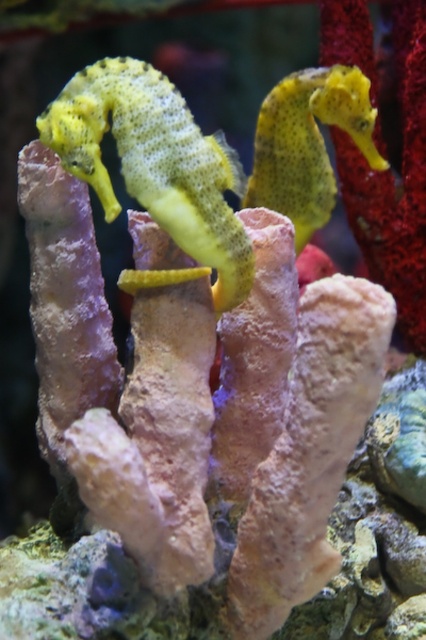
You are an underwater photographer aiming to capture a closeup shot of both seahorses. Given that your camera lens can only focus on objects within 10 cm of the lens, and you are positioned directly in front of the yellow matte seahorse at center, will you be able to capture the yellow textured seahorse at upper right in focus?

The yellow matte seahorse at center is closer to the viewer than the yellow textured seahorse at upper right. Since the camera can only focus within 10 cm and you are positioned in front of the closer seahorse, the distance to the upper right seahorse may exceed the focus range, making it blurry unless adjusted. However, without exact distance measurements, it depends on their separation. The answer requires knowing if their separation is within 10 cm.

You are an aquarium guide explaining the seahorses to a visitor. Pointing to the yellow matte seahorse at center and the yellow textured seahorse at upper right, you want to highlight their size difference. Which seahorse is bigger?

The yellow matte seahorse at center is larger in size compared to the yellow textured seahorse at upper right.